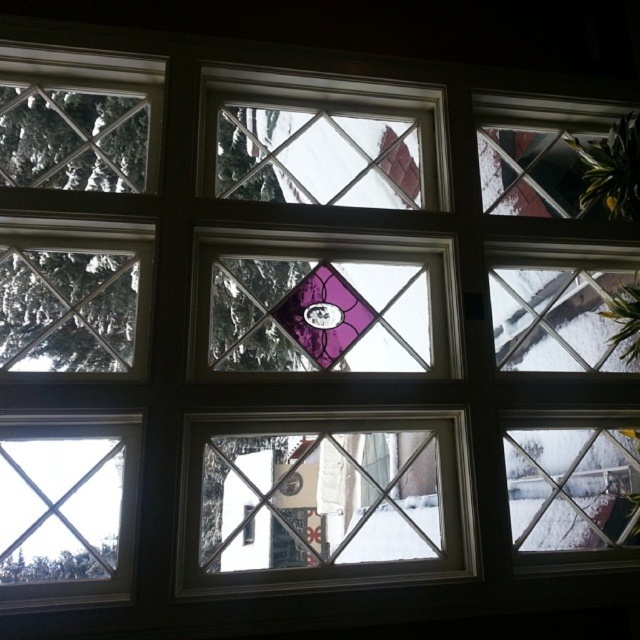
Question: Does clear glass window frame at center have a greater width compared to clear glass window at lower left?

Choices:
 (A) yes
 (B) no

Answer: (A)

Question: Can you confirm if clear glass window frame at center is thinner than clear glass window at lower left?

Choices:
 (A) no
 (B) yes

Answer: (A)

Question: Which point appears farthest from the camera in this image?

Choices:
 (A) (22, 524)
 (B) (324, 481)

Answer: (B)

Question: Can you confirm if clear glass window frame at center is bigger than clear glass window at lower left?

Choices:
 (A) yes
 (B) no

Answer: (A)